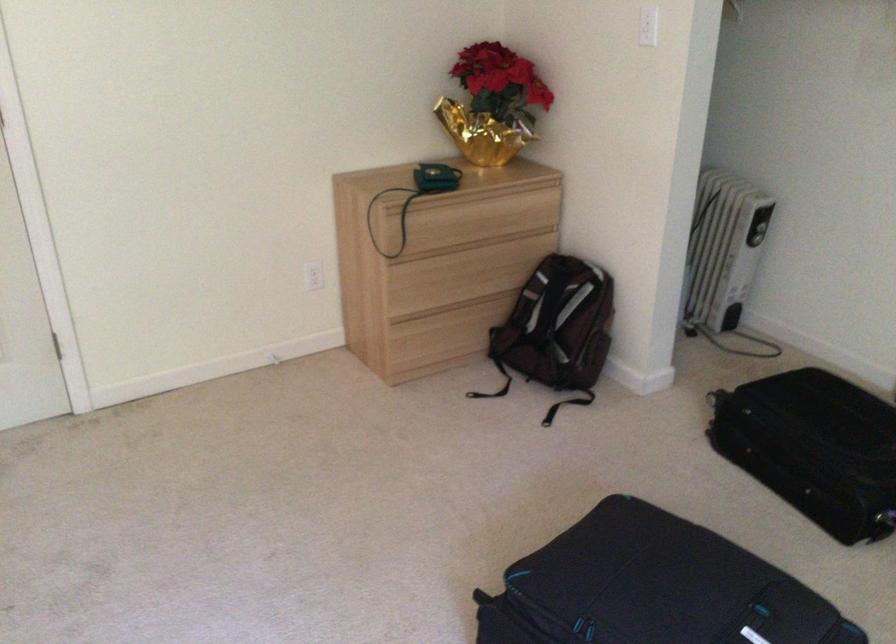
Where would you push the white light switch? Please return your answer as a coordinate pair (x, y).

(648, 26)